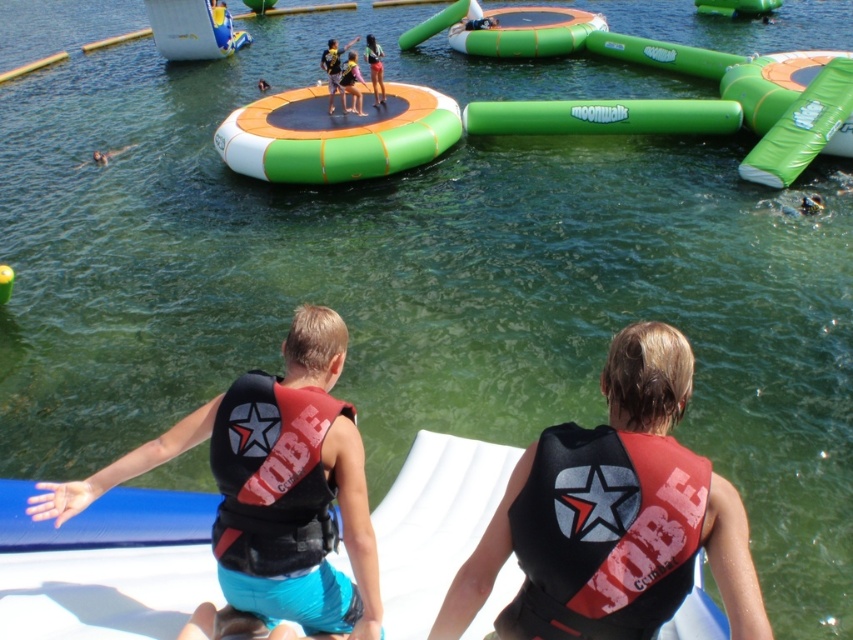
Question: Which object appears farthest from the camera in this image?

Choices:
 (A) red matte life jacket at center
 (B) matte black shorts at center
 (C) green inflatable trampoline at center
 (D) matte black life vest at center

Answer: (D)

Question: Can you confirm if black/red life vest at center is bigger than black fabric life vest at center?

Choices:
 (A) no
 (B) yes

Answer: (A)

Question: Does blue glossy boat at upper left come in front of brown skin at lower left?

Choices:
 (A) yes
 (B) no

Answer: (B)

Question: Considering the real-world distances, which object is farthest from the green inflatable trampoline at upper center?

Choices:
 (A) black/red life vest at center
 (B) blue glossy boat at upper left
 (C) green inflatable trampoline at center

Answer: (A)

Question: Does black/red padded life jacket at center appear on the right side of matte black life vest at upper center?

Choices:
 (A) yes
 (B) no

Answer: (A)

Question: Which of these objects is positioned closest to the matte black life vest at upper center?

Choices:
 (A) green inflatable trampoline at center
 (B) black/red life vest at center

Answer: (A)